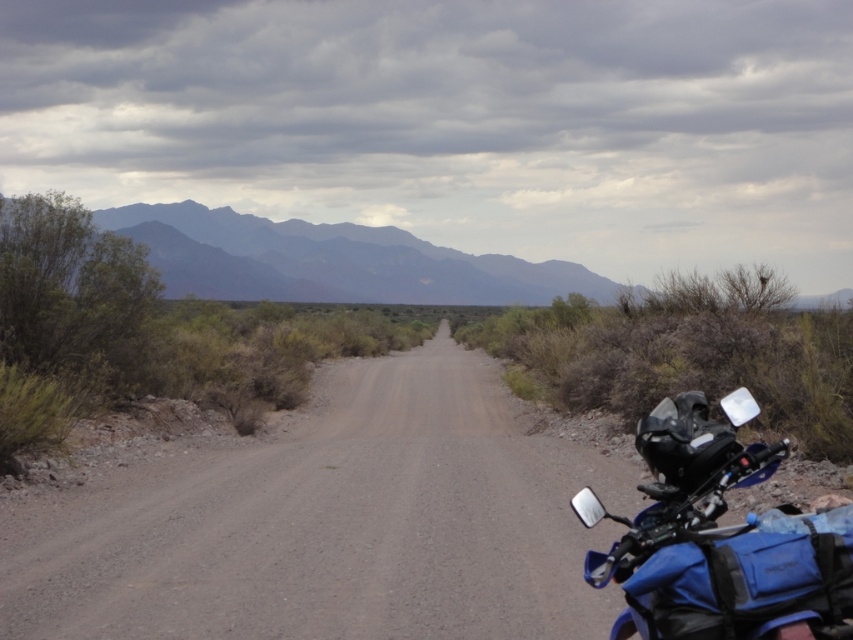
Does dusty gravel road at center have a greater width compared to gray textured mountains at upper center?

In fact, dusty gravel road at center might be narrower than gray textured mountains at upper center.

Is dusty gravel road at center above gray textured mountains at upper center?

No, dusty gravel road at center is not above gray textured mountains at upper center.

Where is `dusty gravel road at center`? The image size is (853, 640). dusty gravel road at center is located at coordinates (329, 524).

Image resolution: width=853 pixels, height=640 pixels. What do you see at coordinates (329, 524) in the screenshot?
I see `dusty gravel road at center` at bounding box center [329, 524].

Does dusty gravel road at center have a larger size compared to blue matte/synthetic motorcycle at right?

Indeed, dusty gravel road at center has a larger size compared to blue matte/synthetic motorcycle at right.

Is point (112, 532) closer to viewer compared to point (805, 579)?

No, (112, 532) is further to viewer.

Identify the location of dusty gravel road at center. (329, 524).

Does blue matte/synthetic motorcycle at right have a larger size compared to gray textured mountains at upper center?

Actually, blue matte/synthetic motorcycle at right might be smaller than gray textured mountains at upper center.

Can you confirm if blue matte/synthetic motorcycle at right is positioned above gray textured mountains at upper center?

Actually, blue matte/synthetic motorcycle at right is below gray textured mountains at upper center.

This screenshot has width=853, height=640. In order to click on blue matte/synthetic motorcycle at right in this screenshot , I will do `click(718, 538)`.

Locate an element on the screen. The height and width of the screenshot is (640, 853). blue matte/synthetic motorcycle at right is located at coordinates (718, 538).